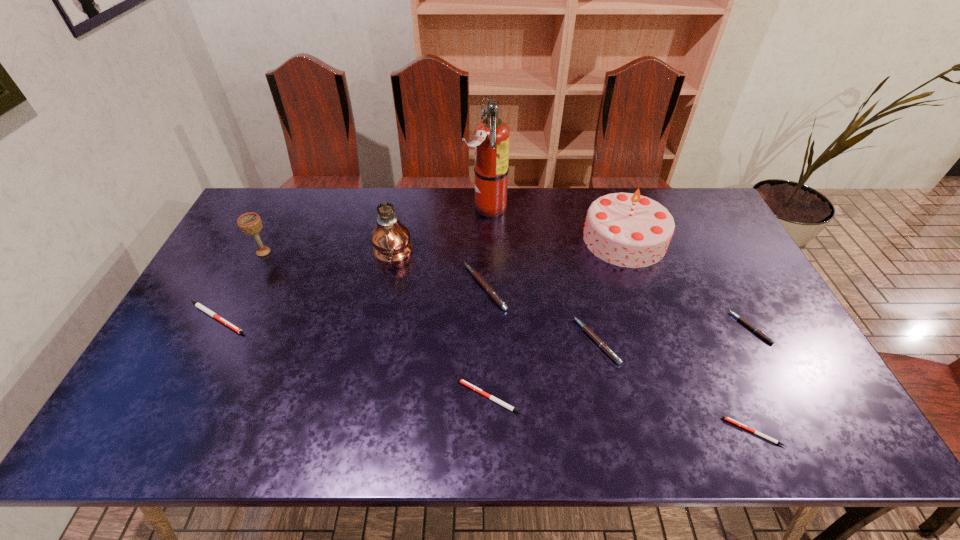
The width and height of the screenshot is (960, 540). I want to click on vacant region located on the clicker of the second pen from right to left, so click(647, 432).

Identify the location of fire extinguisher at the far edge. This screenshot has height=540, width=960. (491, 142).

Image resolution: width=960 pixels, height=540 pixels. I want to click on birthday cake that is at the far edge, so click(629, 230).

You are a GUI agent. You are given a task and a screenshot of the screen. Output one action in this format:
    pyautogui.click(x=<x>, y=<y>)
    Task: Click on the chalice located in the left edge section of the desktop
    
    Given the screenshot: What is the action you would take?
    click(x=250, y=223)

Locate an element on the screen. The height and width of the screenshot is (540, 960). pen situated at the left edge is located at coordinates (198, 305).

Find the location of a particular element. object that is at the near right corner is located at coordinates (725, 418).

This screenshot has width=960, height=540. Find the location of `vacant space at the far edge of the desktop`. vacant space at the far edge of the desktop is located at coordinates point(576,213).

At what (x,y) coordinates should I click in order to perform the action: click on vacant space at the near edge. Please return your answer as a coordinate pair (x, y). This screenshot has height=540, width=960. Looking at the image, I should click on (614, 436).

Identify the location of free space at the left edge of the desktop. (193, 321).

You are a GUI agent. You are given a task and a screenshot of the screen. Output one action in this format:
    pyautogui.click(x=<x>, y=<y>)
    Task: Click on the vacant space at the right edge of the desktop
    Image resolution: width=960 pixels, height=540 pixels.
    Given the screenshot: What is the action you would take?
    pyautogui.click(x=780, y=355)